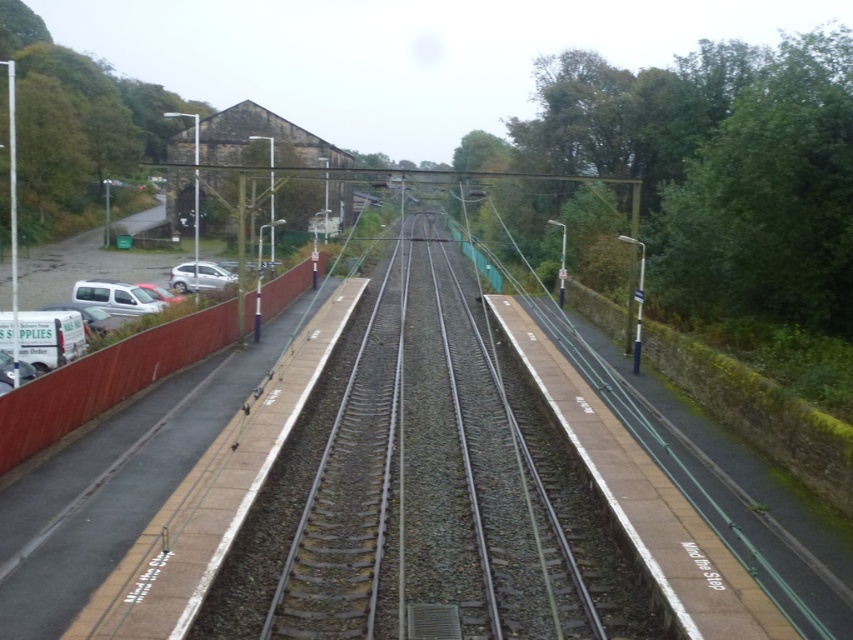
You are a pedestrian standing on the platform looking towards the tracks. You see a smooth metal train track at center and a white matte van at left. Which object is closer to your right side?

The smooth metal train track at center is closer to your right side because it is positioned to the right of the white matte van at left.

You are a pedestrian standing on the platform looking towards the parking lot. You see a white matte van at left and a satin silver car at left. Which vehicle is closer to the red fence?

The white matte van at left is closer to the red fence because it is positioned to the left of the satin silver car at left, and the red fence is on the left side of the parking lot.

In the scene shown: You are a delivery driver who needs to park your white matte van at left in the parking lot near the red fence. The parking space is only as wide as the smooth metal train track at center. Will your van fit in the space?

The smooth metal train track at center has a lesser width compared to the white matte van at left. Since the parking space is only as wide as the train track, the van will not fit in the space.